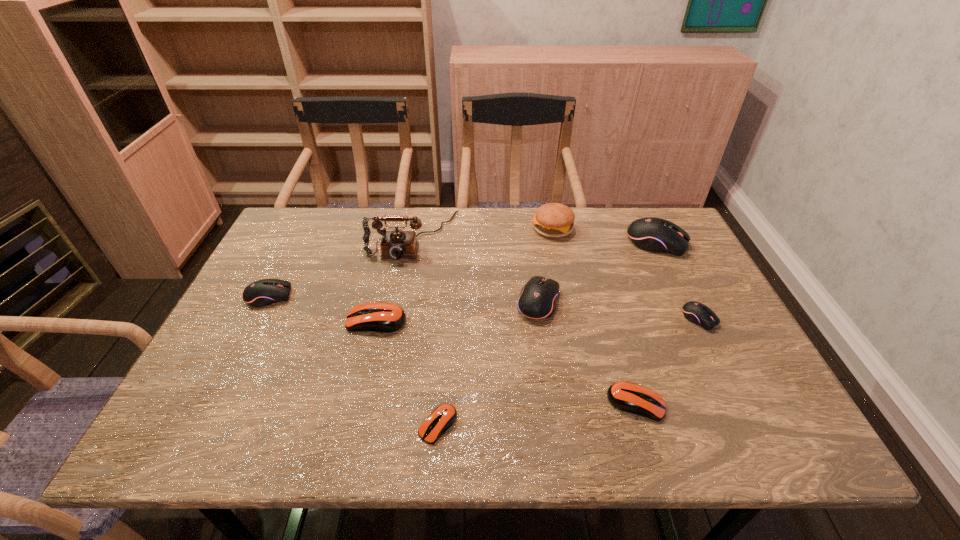
This screenshot has width=960, height=540. Identify the location of the tallest object. (397, 244).

Image resolution: width=960 pixels, height=540 pixels. In order to click on hamburger in this screenshot , I will do tap(555, 220).

I want to click on the biggest black computer mouse, so click(x=651, y=234).

You are a GUI agent. You are given a task and a screenshot of the screen. Output one action in this format:
    pyautogui.click(x=<x>, y=<y>)
    Task: Click on the tallest computer mouse
    This screenshot has width=960, height=540.
    Given the screenshot: What is the action you would take?
    pyautogui.click(x=651, y=234)

Locate an element on the screen. This screenshot has width=960, height=540. the sixth shortest object is located at coordinates (538, 298).

Identify the location of the second biggest black computer mouse. This screenshot has height=540, width=960. (538, 298).

The width and height of the screenshot is (960, 540). What are the coordinates of `the second smallest black computer mouse` in the screenshot? It's located at (261, 293).

Locate an element on the screen. The height and width of the screenshot is (540, 960). the leftmost object is located at coordinates (261, 293).

Where is `the biggest orange computer mouse`? The image size is (960, 540). the biggest orange computer mouse is located at coordinates (374, 317).

Image resolution: width=960 pixels, height=540 pixels. I want to click on the leftmost orange computer mouse, so click(374, 317).